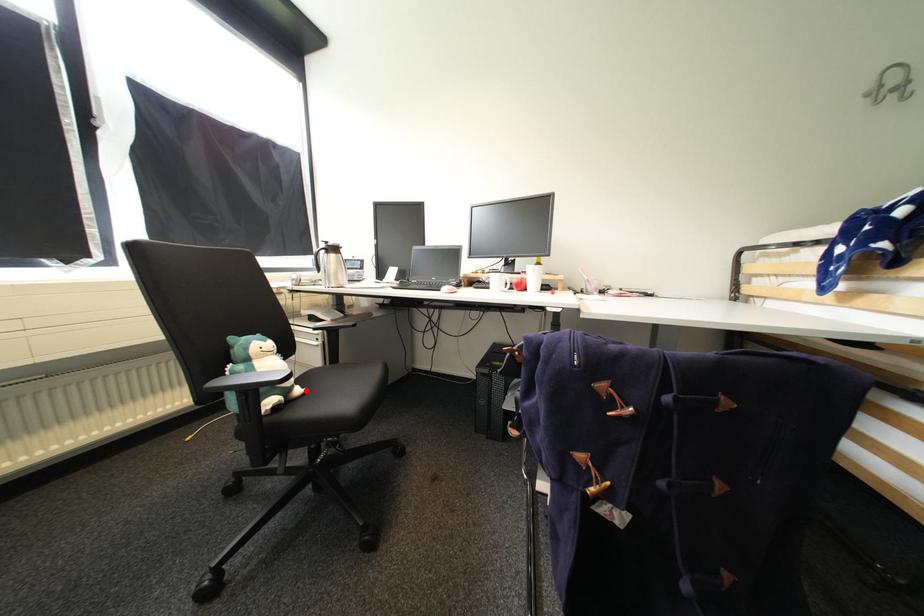
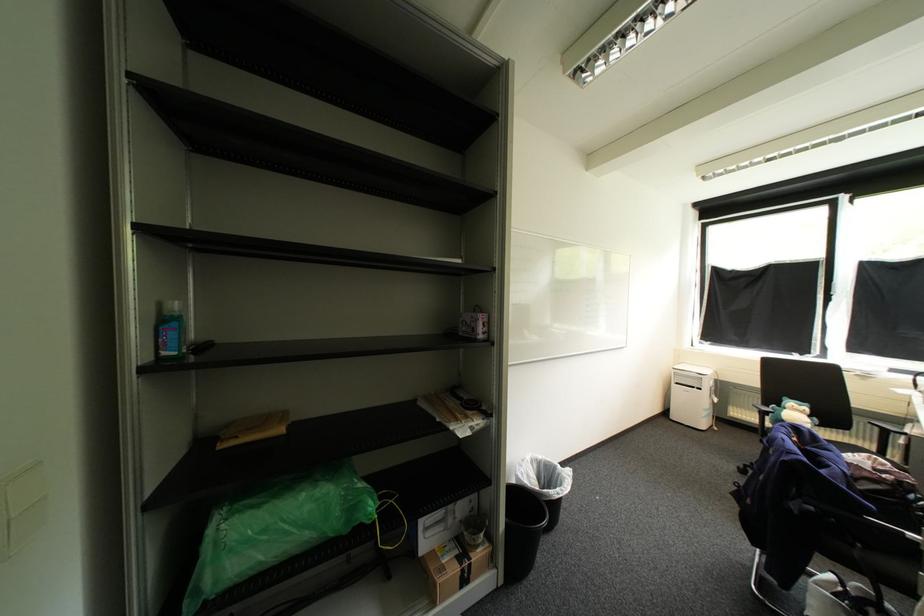
Question: I am providing you with two images of the same scene from different viewpoints. A red point is marked on the first image. At the location where the point appears in image 1, is it still visible in image 2?

Choices:
 (A) Yes
 (B) No

Answer: (B)